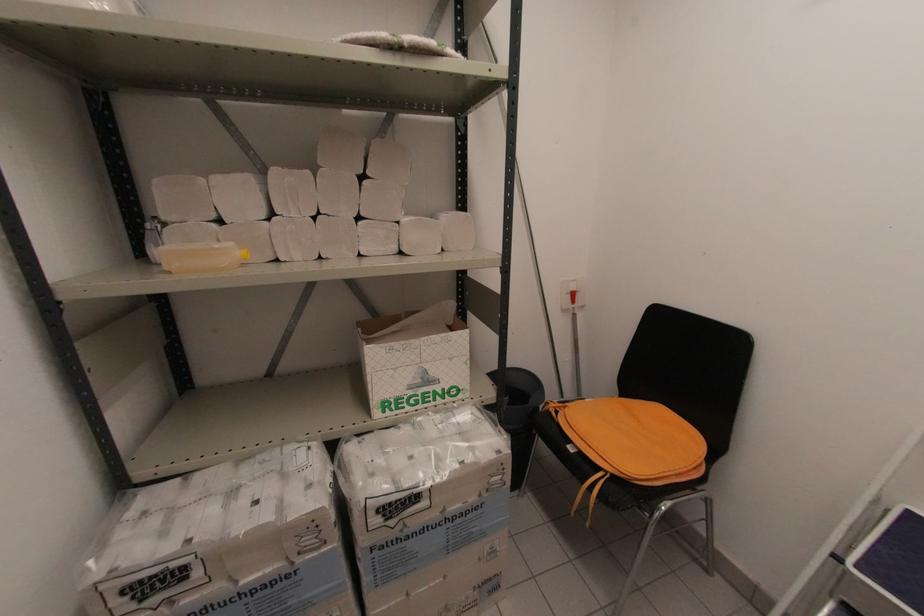
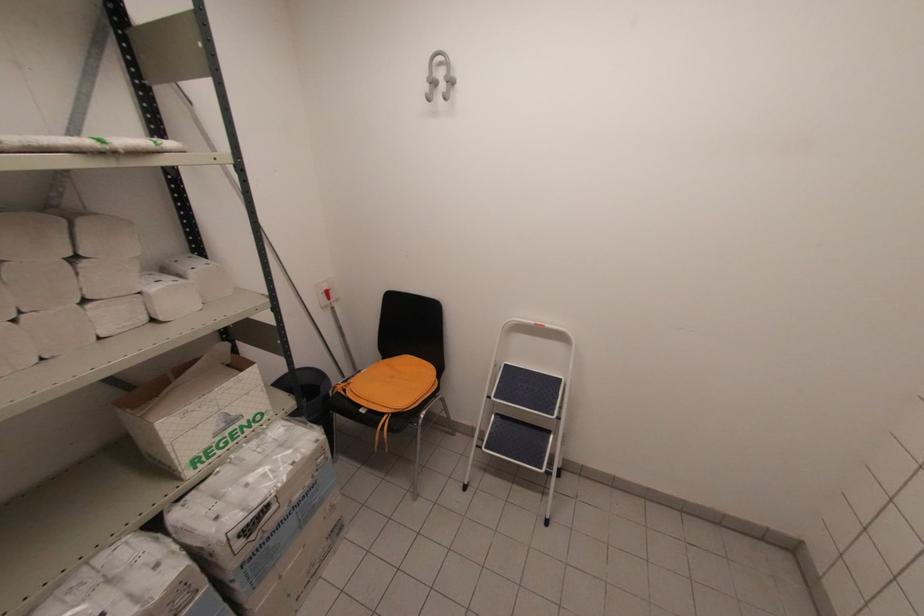
Locate, in the second image, the point that corresponds to point (575, 302) in the first image.

(330, 299)